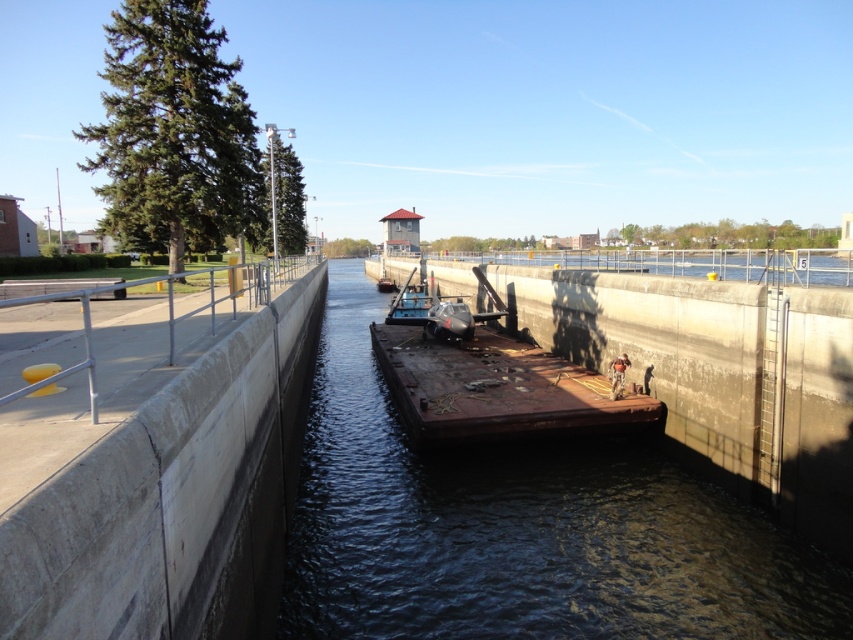
You are a boat operator trying to navigate a small boat through the lock. The lock has a rusty metal water at center and a rusty metal barge at center. Based on the scene, can your boat pass through the lock safely if it is 10 meters wide?

The rusty metal water at center might be wider than the rusty metal barge at center. Since the water is likely the navigable area, if the water width is greater than 10 meters, your boat can pass safely. However, the exact width isn

You are a boat operator trying to navigate a new barge into the lock. The lock has a rusty metal water at center and a rusty metal barge at center. Which object is higher in elevation?

The rusty metal water at center is taller than the rusty metal barge at center, so the water is higher in elevation than the barge.

You are an engineer tasked with ensuring safe passage for a new boat that is 3 meters long. The boat needs to pass between the rusty metal water at center and the rusty metal barge at center. Based on the image, will the boat be able to navigate this space?

The rusty metal water at center and rusty metal barge at center are 2.26 meters apart. Since the boat is 3 meters long, which is longer than the available space, the boat will not be able to navigate safely between them.